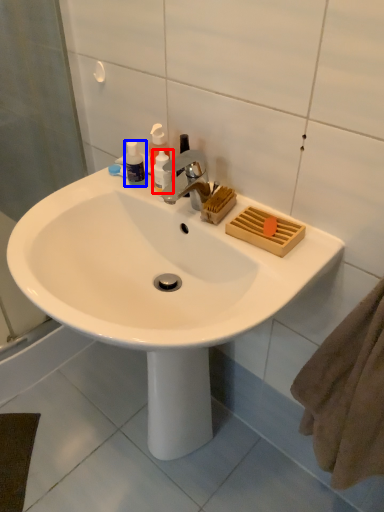
Question: Which point is closer to the camera, toiletry (highlighted by a red box) or toiletry (highlighted by a blue box)?

Choices:
 (A) toiletry
 (B) toiletry

Answer: (A)